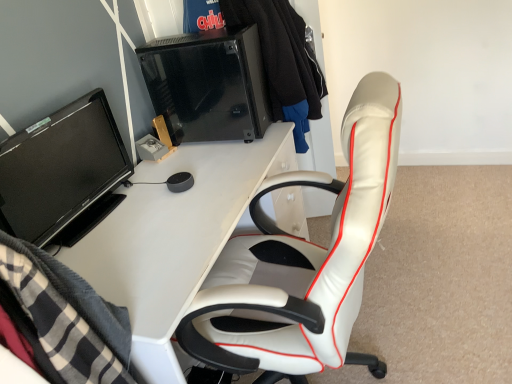
Image resolution: width=512 pixels, height=384 pixels. What do you see at coordinates (208, 85) in the screenshot? I see `black glass desktop computer at upper center` at bounding box center [208, 85].

This screenshot has width=512, height=384. In order to click on black glass desktop computer at upper center in this screenshot , I will do `click(208, 85)`.

Considering the positions of points (157, 173) and (311, 76), is point (157, 173) closer to camera compared to point (311, 76)?

Yes, point (157, 173) is closer to viewer.

Does white glossy desk at center contain black fabric jacket at upper center?

No, black fabric jacket at upper center is not a part of white glossy desk at center.

Does white glossy desk at center turn towards black fabric jacket at upper center?

No, white glossy desk at center is not oriented towards black fabric jacket at upper center.

In the scene shown: Between black fabric jacket at upper center and black glass desktop computer at upper center, which one appears on the left side from the viewer's perspective?

From the viewer's perspective, black glass desktop computer at upper center appears more on the left side.

Between black fabric jacket at upper center and black glass desktop computer at upper center, which one has larger width?

Wider between the two is black glass desktop computer at upper center.

What's the angular difference between black fabric jacket at upper center and black glass desktop computer at upper center's facing directions?

They differ by 77.5 degrees in their facing directions.

From the image's perspective, which is below, black fabric jacket at upper center or black glass desktop computer at upper center?

From the image's view, black glass desktop computer at upper center is below.

How many degrees apart are the facing directions of black fabric jacket at upper center and white glossy desk at center?

74.3 degrees separate the facing orientations of black fabric jacket at upper center and white glossy desk at center.

From a real-world perspective, who is located higher, black fabric jacket at upper center or white glossy desk at center?

black fabric jacket at upper center, from a real-world perspective.

Based on their sizes in the image, would you say black fabric jacket at upper center is bigger or smaller than white glossy desk at center?

Considering their sizes, black fabric jacket at upper center takes up less space than white glossy desk at center.

From a real-world perspective, is black glossy monitor at left physically below white leather chair at right?

Incorrect, from a real-world perspective, black glossy monitor at left is higher than white leather chair at right.

Between black glossy monitor at left and white leather chair at right, which one has more height?

white leather chair at right.

Considering the positions of objects black glossy monitor at left and white leather chair at right in the image provided, who is behind, black glossy monitor at left or white leather chair at right?

black glossy monitor at left.

Find the location of a particular element. chair below the black glossy monitor at left (from the image's perspective) is located at coordinates (304, 262).

Is black fabric jacket at upper center far from black glossy monitor at left?

No.

In the image, is black fabric jacket at upper center on the left side or the right side of black glossy monitor at left?

In the image, black fabric jacket at upper center appears on the right side of black glossy monitor at left.

Is black fabric jacket at upper center oriented away from black glossy monitor at left?

No, black glossy monitor at left is not at the back of black fabric jacket at upper center.

Considering the sizes of objects black fabric jacket at upper center and black glossy monitor at left in the image provided, who is bigger, black fabric jacket at upper center or black glossy monitor at left?

black fabric jacket at upper center.

How many degrees apart are the facing directions of black glossy monitor at left and black glass desktop computer at upper center?

3.58 degrees.

Can you confirm if black glossy monitor at left is positioned to the right of black glass desktop computer at upper center?

Incorrect, black glossy monitor at left is not on the right side of black glass desktop computer at upper center.

Is black glossy monitor at left facing towards black glass desktop computer at upper center?

No.

From the image's perspective, is black glossy monitor at left beneath black glass desktop computer at upper center?

Correct, black glossy monitor at left appears lower than black glass desktop computer at upper center in the image.

Which is in front, point (317, 292) or point (37, 213)?

The point (317, 292) is closer to the camera.

Identify the location of chair on the right of the black glossy monitor at left. (304, 262).

Is white leather chair at right placed right next to black glossy monitor at left?

No, white leather chair at right is not next to black glossy monitor at left.

Would you say white leather chair at right is outside black glossy monitor at left?

white leather chair at right lies outside black glossy monitor at left's area.

Where is `desk below the black fabric jacket at upper center (from the image's perspective)`? The width and height of the screenshot is (512, 384). desk below the black fabric jacket at upper center (from the image's perspective) is located at coordinates (174, 238).

At what (x,y) coordinates should I click in order to perform the action: click on desktop computer that appears below the black fabric jacket at upper center (from a real-world perspective). Please return your answer as a coordinate pair (x, y). The height and width of the screenshot is (384, 512). Looking at the image, I should click on (208, 85).

Based on their spatial positions, is white leather chair at right or black glass desktop computer at upper center further from black fabric jacket at upper center?

white leather chair at right is further to black fabric jacket at upper center.

When comparing their distances from white glossy desk at center, does black glass desktop computer at upper center or black glossy monitor at left seem closer?

black glossy monitor at left is closer to white glossy desk at center.

Looking at the image, which one is located further to black glossy monitor at left, white glossy desk at center or black glass desktop computer at upper center?

black glass desktop computer at upper center is further to black glossy monitor at left.

Based on their spatial positions, is white leather chair at right or black glass desktop computer at upper center further from white glossy desk at center?

black glass desktop computer at upper center lies further to white glossy desk at center than the other object.

Based on the photo, considering their positions, is black glass desktop computer at upper center positioned closer to black fabric jacket at upper center than white leather chair at right?

black glass desktop computer at upper center is closer to black fabric jacket at upper center.

Considering their positions, is white glossy desk at center positioned closer to black glossy monitor at left than black fabric jacket at upper center?

white glossy desk at center is positioned closer to the anchor black glossy monitor at left.

Based on their spatial positions, is white glossy desk at center or black fabric jacket at upper center closer to white leather chair at right?

white glossy desk at center is positioned closer to the anchor white leather chair at right.

Based on their spatial positions, is white leather chair at right or black fabric jacket at upper center further from black glossy monitor at left?

black fabric jacket at upper center.

Image resolution: width=512 pixels, height=384 pixels. In order to click on television between white leather chair at right and black glass desktop computer at upper center from front to back in this screenshot , I will do `click(63, 173)`.

At what (x,y) coordinates should I click in order to perform the action: click on television between white leather chair at right and black fabric jacket at upper center in the front-back direction. Please return your answer as a coordinate pair (x, y). Looking at the image, I should click on (63, 173).

The height and width of the screenshot is (384, 512). I want to click on desk between black glossy monitor at left and white leather chair at right in the horizontal direction, so click(x=174, y=238).

This screenshot has width=512, height=384. I want to click on television between black glass desktop computer at upper center and white glossy desk at center in the vertical direction, so click(x=63, y=173).